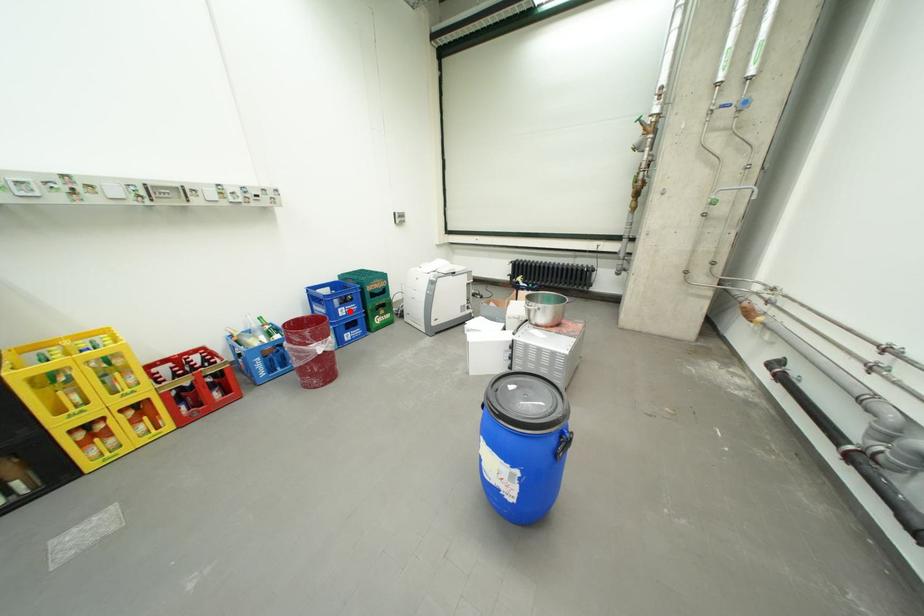
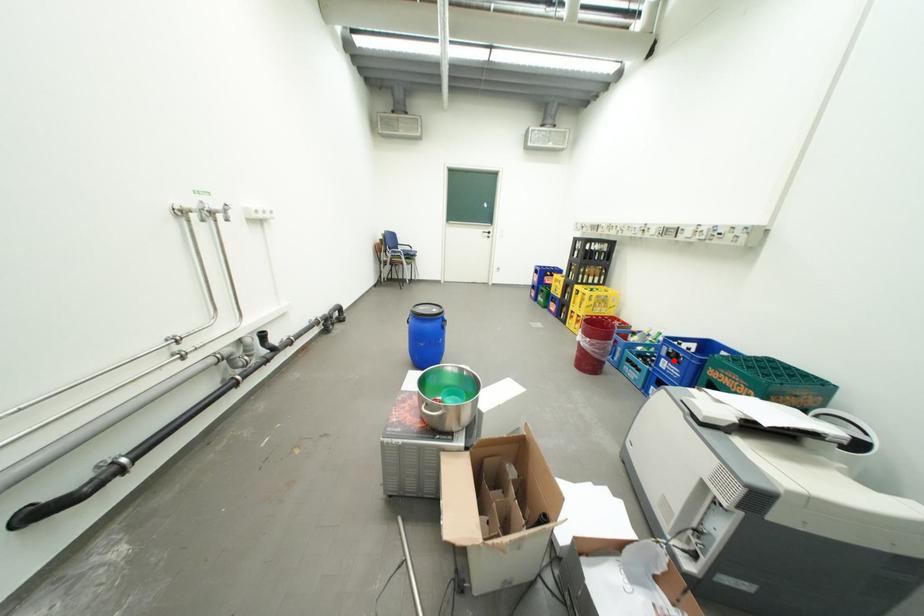
I am providing you with two images of the same scene from different viewpoints. A red point is marked on the first image and another point is marked on the second image. Is the red point in image1 aligned with the point shown in image2?

Yes